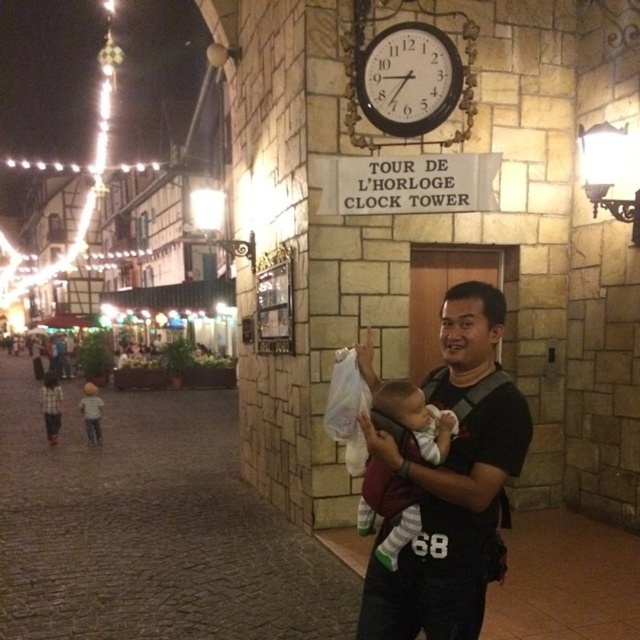
You are standing in the town square and see the black fabric baby carrier at center. Where exactly is it located in relation to the clock tower?

The black fabric baby carrier at center is located at point (452,483) in relation to the clock tower.